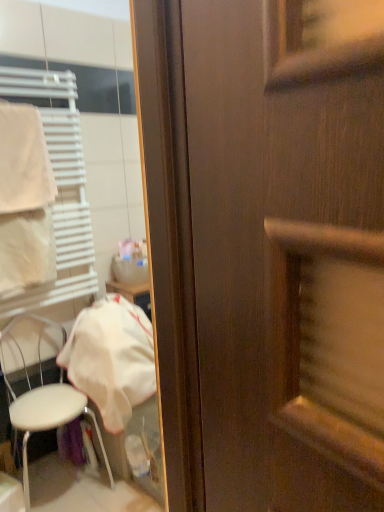
Question: Is the depth of white fabric at left greater than that of white plastic chair at lower left?

Choices:
 (A) no
 (B) yes

Answer: (B)

Question: Considering the relative sizes of white fabric at left and white plastic chair at lower left in the image provided, is white fabric at left taller than white plastic chair at lower left?

Choices:
 (A) yes
 (B) no

Answer: (B)

Question: Does white fabric at left have a larger size compared to white plastic chair at lower left?

Choices:
 (A) yes
 (B) no

Answer: (B)

Question: From the image's perspective, is white fabric at left over white plastic chair at lower left?

Choices:
 (A) yes
 (B) no

Answer: (A)

Question: Is white fabric at left thinner than white plastic chair at lower left?

Choices:
 (A) no
 (B) yes

Answer: (A)

Question: Is white fabric at left at the left side of white plastic chair at lower left?

Choices:
 (A) yes
 (B) no

Answer: (B)

Question: Is white fabric towel at left completely or partially inside white plastic chair at lower left?

Choices:
 (A) no
 (B) yes

Answer: (A)

Question: Considering the relative sizes of white plastic chair at lower left and white fabric towel at left in the image provided, is white plastic chair at lower left shorter than white fabric towel at left?

Choices:
 (A) yes
 (B) no

Answer: (B)

Question: Can you confirm if white plastic chair at lower left is wider than white fabric towel at left?

Choices:
 (A) no
 (B) yes

Answer: (B)

Question: Is white plastic chair at lower left to the right of white fabric towel at left from the viewer's perspective?

Choices:
 (A) no
 (B) yes

Answer: (B)

Question: Is white plastic chair at lower left touching white fabric towel at left?

Choices:
 (A) no
 (B) yes

Answer: (A)

Question: Is the depth of white plastic chair at lower left greater than that of white fabric towel at left?

Choices:
 (A) yes
 (B) no

Answer: (B)

Question: Can you confirm if white plastic chair at lower left is shorter than white fabric at left?

Choices:
 (A) no
 (B) yes

Answer: (A)